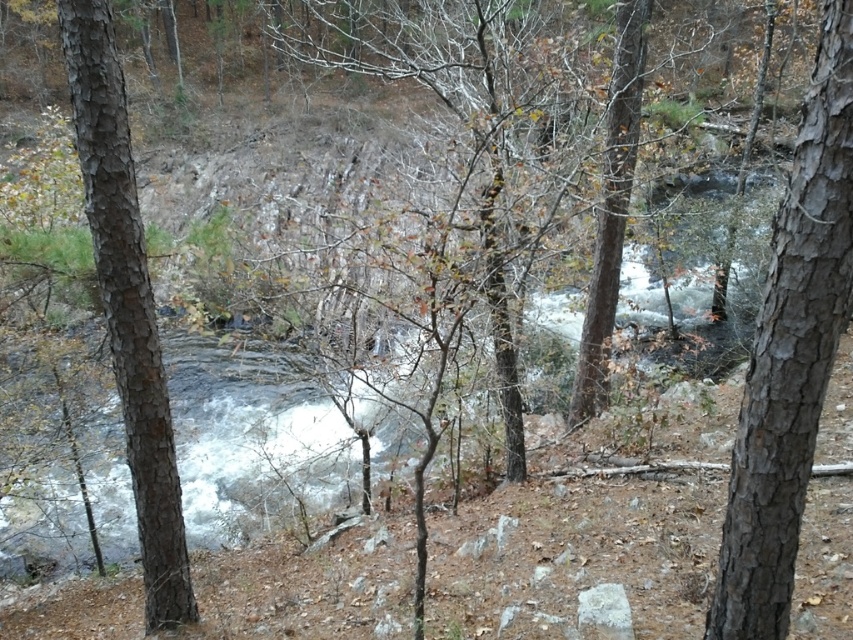
In the scene shown: You are standing on the riverbank and want to take a photo of both the smooth bark tree at right and the smooth bark tree at left. Which tree should you position closer to the camera to include both in the frame without one blocking the other?

To include both the smooth bark tree at right and the smooth bark tree at left in the frame without one blocking the other, you should position yourself closer to the smooth bark tree at right since it is in front of the smooth bark tree at left.

From the picture: You are a hiker trying to cross the river using the trees as landmarks. Which tree should you aim for first if you want to cross to the opposite bank, the smooth bark tree at right or the brown rough tree at center?

The smooth bark tree at right is smaller than the brown rough tree at center, so you should aim for the brown rough tree at center first as it is larger and likely closer to the opposite bank.